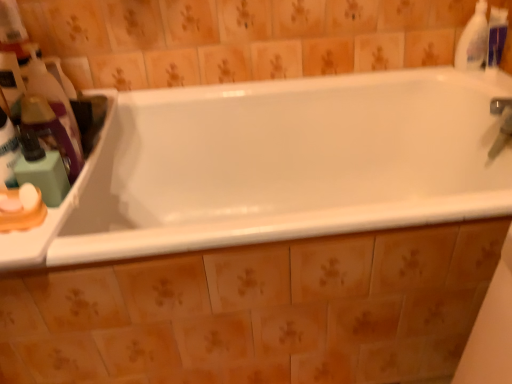
Question: Is translucent plastic bottle at left, the 1th cleaning product when ordered from left to right, far away from white glossy bathtub at center?

Choices:
 (A) yes
 (B) no

Answer: (B)

Question: Considering the relative sizes of translucent plastic bottle at left, the 1th cleaning product when ordered from left to right, and white glossy bathtub at center in the image provided, is translucent plastic bottle at left, the 1th cleaning product when ordered from left to right, shorter than white glossy bathtub at center?

Choices:
 (A) yes
 (B) no

Answer: (A)

Question: Could you tell me if translucent plastic bottle at left, the 1th cleaning product when ordered from left to right, is facing white glossy bathtub at center?

Choices:
 (A) no
 (B) yes

Answer: (A)

Question: From the image's perspective, is translucent plastic bottle at left, the 1th cleaning product when ordered from left to right, on top of white glossy bathtub at center?

Choices:
 (A) no
 (B) yes

Answer: (B)

Question: Can you confirm if translucent plastic bottle at left, acting as the third cleaning product starting from the right, is taller than white glossy bathtub at center?

Choices:
 (A) no
 (B) yes

Answer: (A)

Question: Is translucent plastic bottle at left, acting as the third cleaning product starting from the right, outside white glossy bathtub at center?

Choices:
 (A) yes
 (B) no

Answer: (A)

Question: Would you consider white plastic counter at left to be distant from translucent plastic bottle at left, marked as the second cleaning product in a front-to-back arrangement?

Choices:
 (A) no
 (B) yes

Answer: (A)

Question: Is white plastic counter at left turned away from translucent plastic bottle at left, the 1th cleaning product when ordered from left to right?

Choices:
 (A) no
 (B) yes

Answer: (A)

Question: Could you tell me if white plastic counter at left is facing translucent plastic bottle at left, the 1th cleaning product when ordered from left to right?

Choices:
 (A) yes
 (B) no

Answer: (B)

Question: From the image's perspective, is white plastic counter at left beneath translucent plastic bottle at left, marked as the second cleaning product in a front-to-back arrangement?

Choices:
 (A) yes
 (B) no

Answer: (A)

Question: Considering the relative positions of white plastic counter at left and translucent plastic bottle at left, the 1th cleaning product when ordered from left to right, in the image provided, is white plastic counter at left in front of translucent plastic bottle at left, the 1th cleaning product when ordered from left to right,?

Choices:
 (A) no
 (B) yes

Answer: (B)

Question: Can you confirm if white plastic counter at left is taller than translucent plastic bottle at left, the 1th cleaning product when ordered from left to right?

Choices:
 (A) no
 (B) yes

Answer: (A)

Question: Considering the relative sizes of white plastic bottle at upper right, which is the 1th cleaning product from right to left, and translucent plastic bottle at left, marked as the second cleaning product in a front-to-back arrangement, in the image provided, is white plastic bottle at upper right, which is the 1th cleaning product from right to left, smaller than translucent plastic bottle at left, marked as the second cleaning product in a front-to-back arrangement,?

Choices:
 (A) no
 (B) yes

Answer: (B)